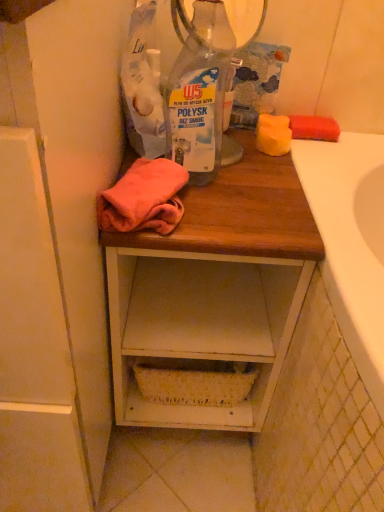
At what (x,y) coordinates should I click in order to perform the action: click on unoccupied area in front of transparent plastic bottle at center. Please return your answer as a coordinate pair (x, y). The width and height of the screenshot is (384, 512). Looking at the image, I should click on (229, 212).